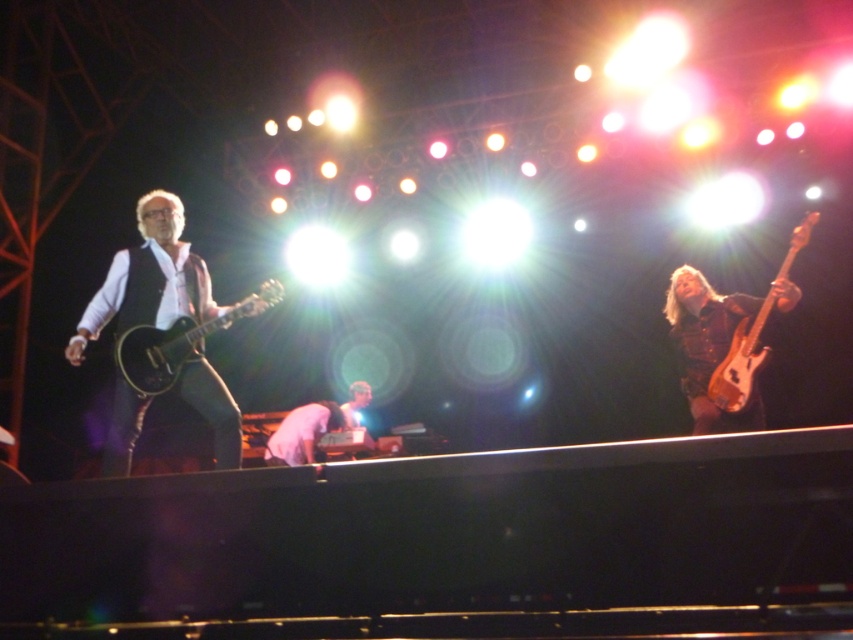
You are a photographer at the concert and want to capture both the shiny black electric guitar at left and the wooden electric guitar at right in a single frame. Which guitar should you focus on first if you want to ensure both are in the shot?

The shiny black electric guitar at left is positioned on the left side of wooden electric guitar at right, so focusing on the wooden electric guitar at right first would center the composition and allow both guitars to be captured in the frame.

You are a photographer at the concert and want to capture both the matte black guitar at left and the wooden electric guitar at right in a single frame. Which guitar should you focus on first if you want to ensure both are in the shot?

The matte black guitar at left is positioned on the left side of wooden electric guitar at right, so focusing on the wooden electric guitar at right first would center the composition and allow the matte black guitar at left to naturally fall into the frame.